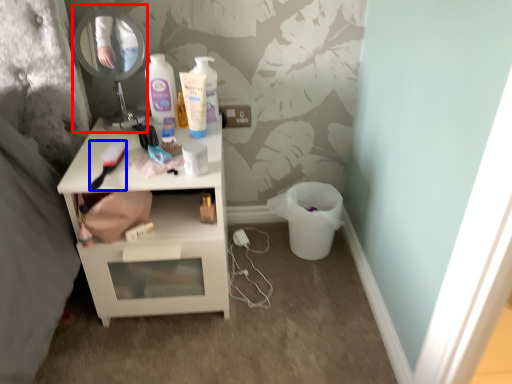
Question: Among these objects, which one is nearest to the camera, mirror (highlighted by a red box) or brush (highlighted by a blue box)?

Choices:
 (A) mirror
 (B) brush

Answer: (B)